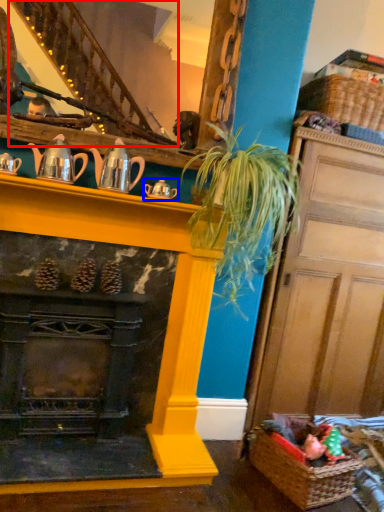
Question: Which object appears farthest to the camera in this image, stairwell (highlighted by a red box) or tea pot (highlighted by a blue box)?

Choices:
 (A) stairwell
 (B) tea pot

Answer: (B)